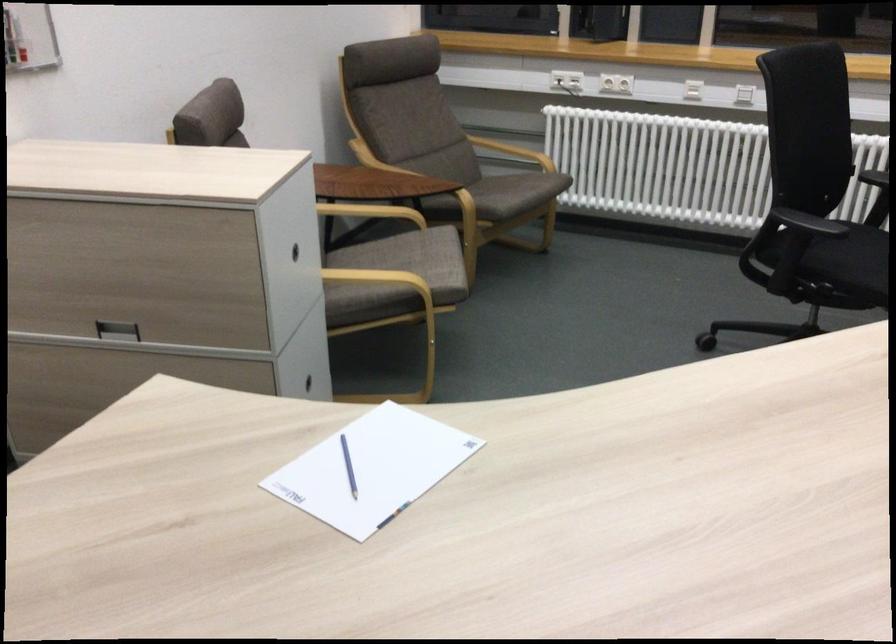
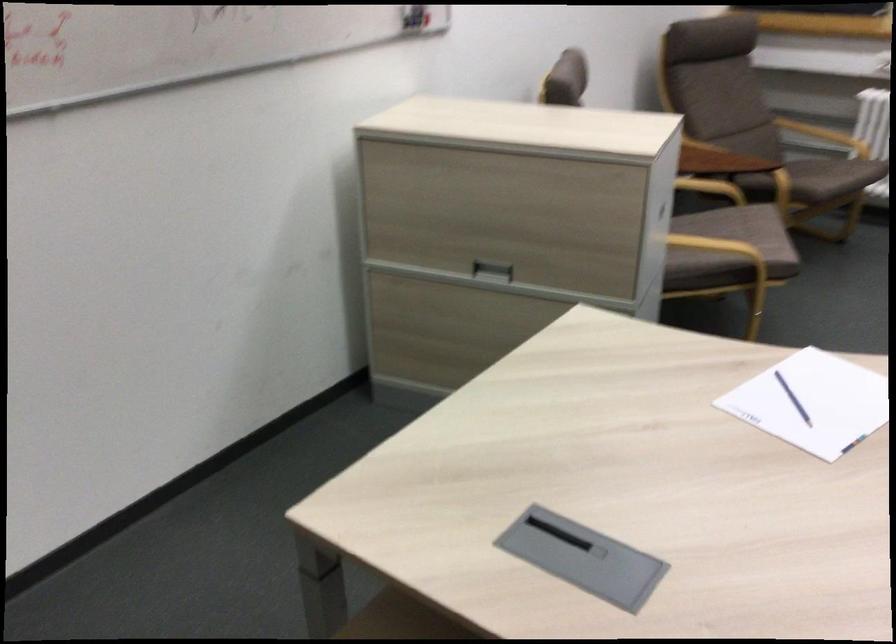
Locate, in the second image, the point that corresponds to (x=125, y=333) in the first image.

(492, 270)